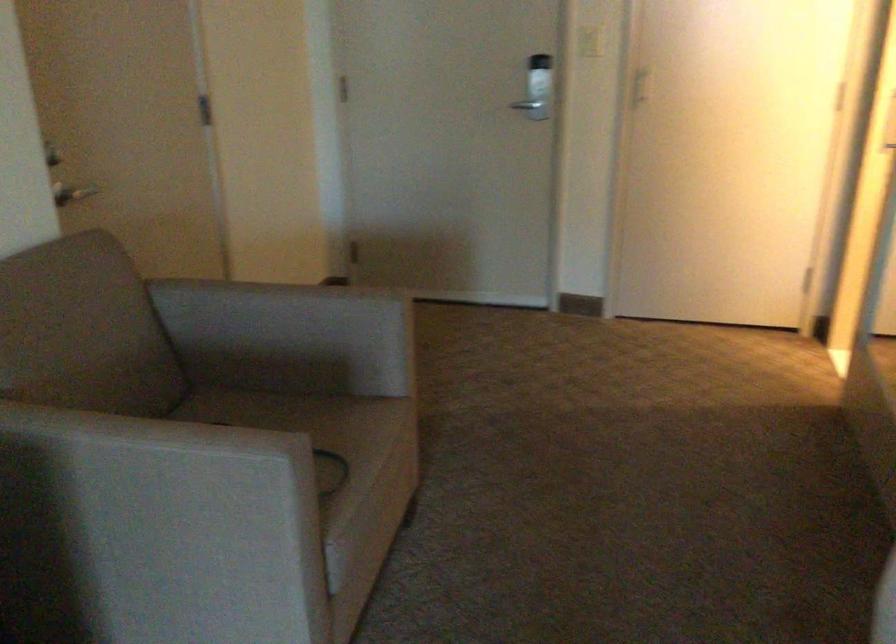
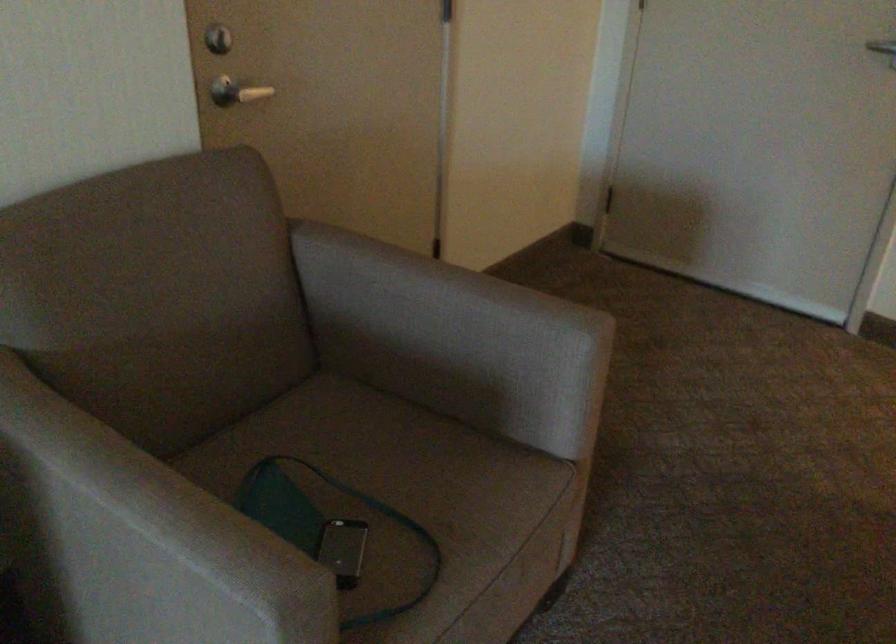
Find the pixel in the second image that matches the point at 303,334 in the first image.

(453, 339)